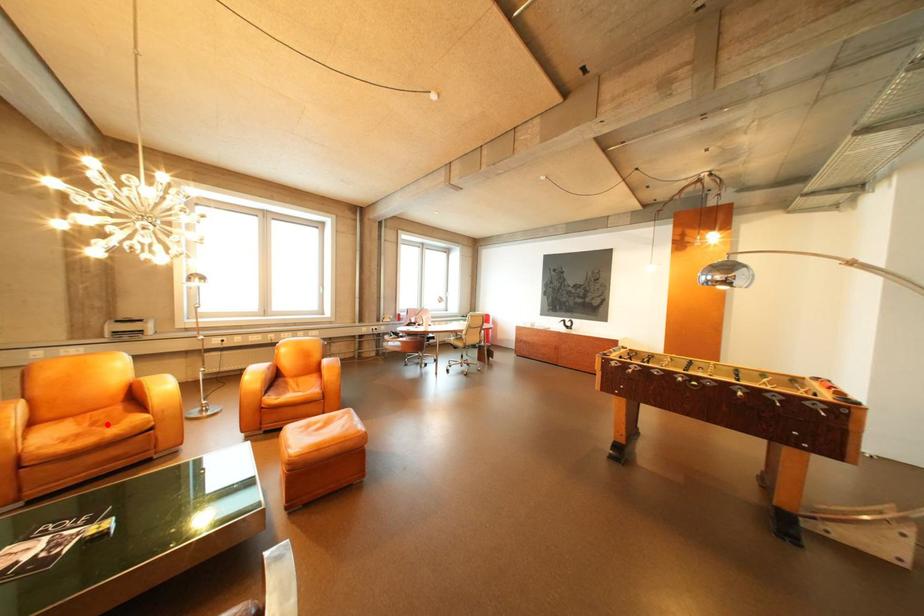
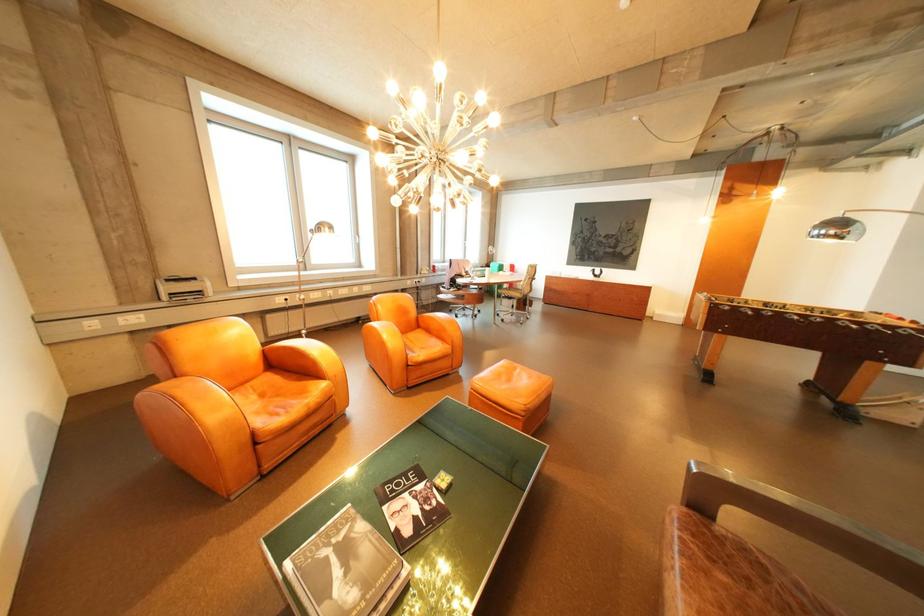
Where in the second image is the point corresponding to the highlighted location from the first image?

(275, 395)